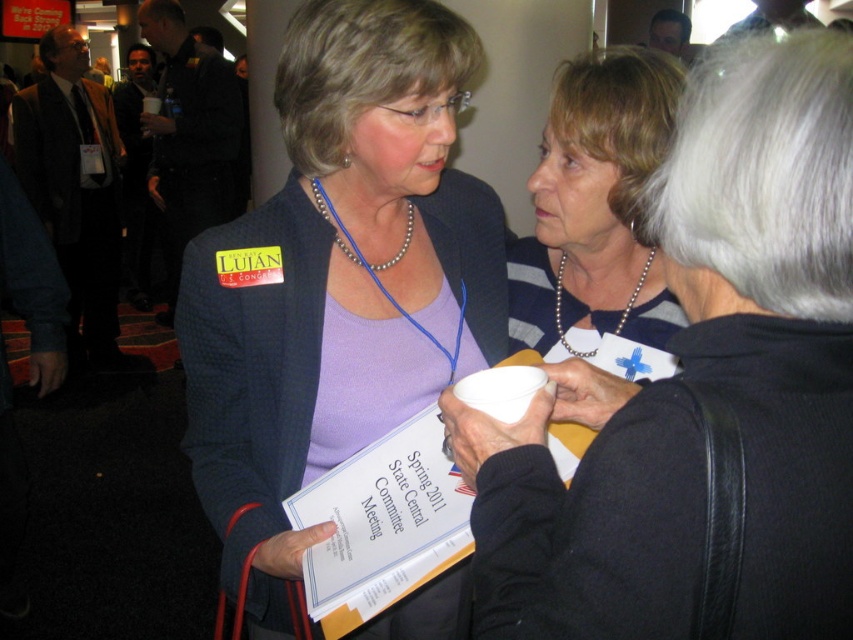
Is matte white cup at center below matte black blazer at center?

No.

Is matte white cup at center closer to camera compared to matte black blazer at center?

Yes, it is.

Is point (691, 332) in front of point (335, 154)?

Yes, point (691, 332) is closer to viewer.

Locate an element on the screen. matte white cup at center is located at coordinates (700, 387).

Can you confirm if matte white cup at center is positioned below pearl necklace at center?

Yes.

Locate an element on the screen. matte white cup at center is located at coordinates (700, 387).

Is matte black blazer at center to the left of pearl necklace at center from the viewer's perspective?

Yes, matte black blazer at center is to the left of pearl necklace at center.

Is matte black blazer at center to the right of pearl necklace at center from the viewer's perspective?

Incorrect, matte black blazer at center is not on the right side of pearl necklace at center.

Is point (262, 236) farther from camera compared to point (556, 323)?

No.

This screenshot has height=640, width=853. What are the coordinates of `matte black blazer at center` in the screenshot? It's located at (337, 282).